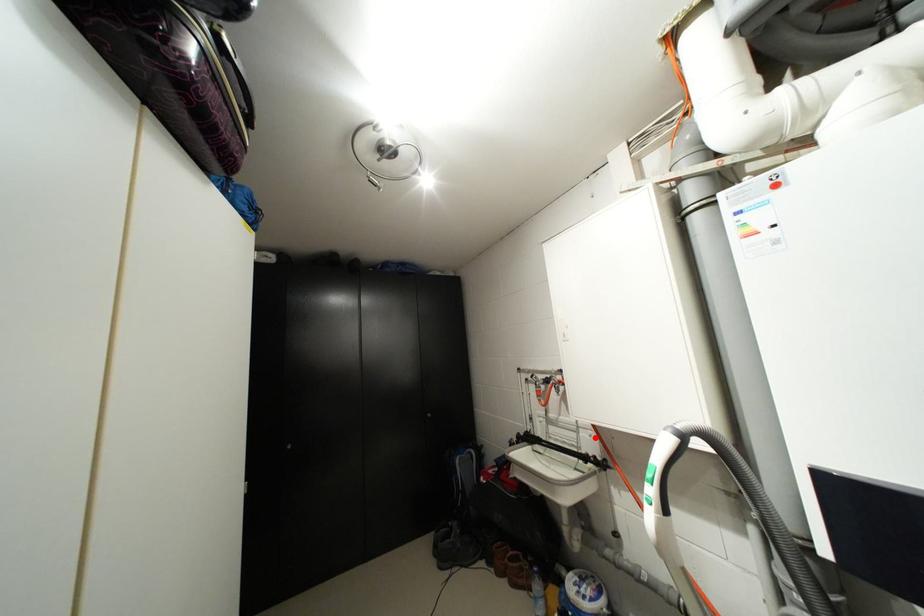
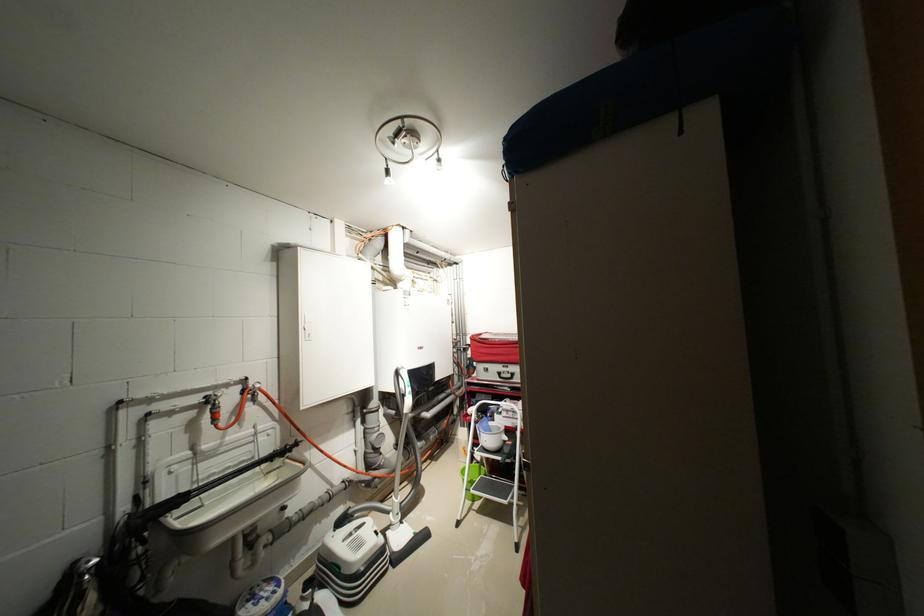
Find the pixel in the second image that matches the highlighted location in the first image.

(273, 439)